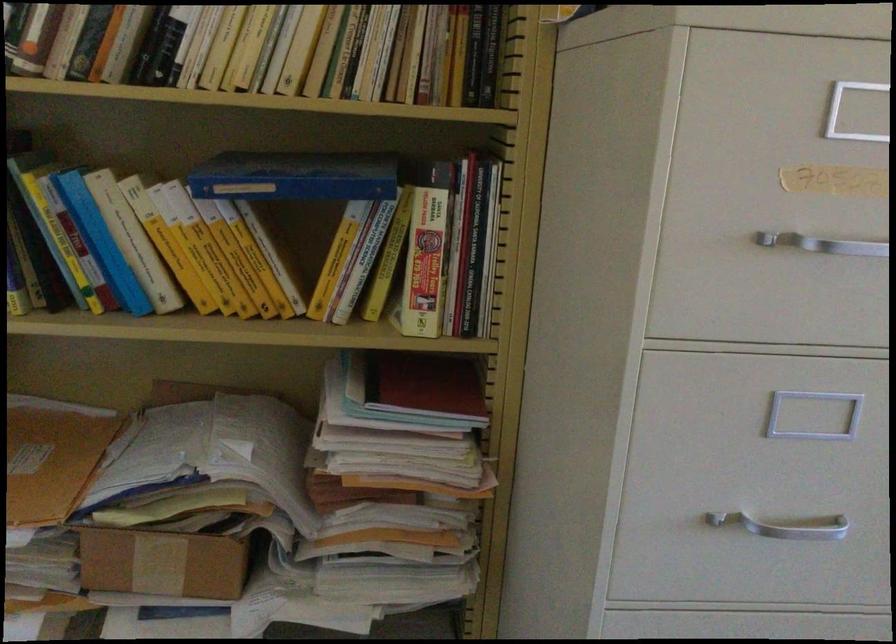
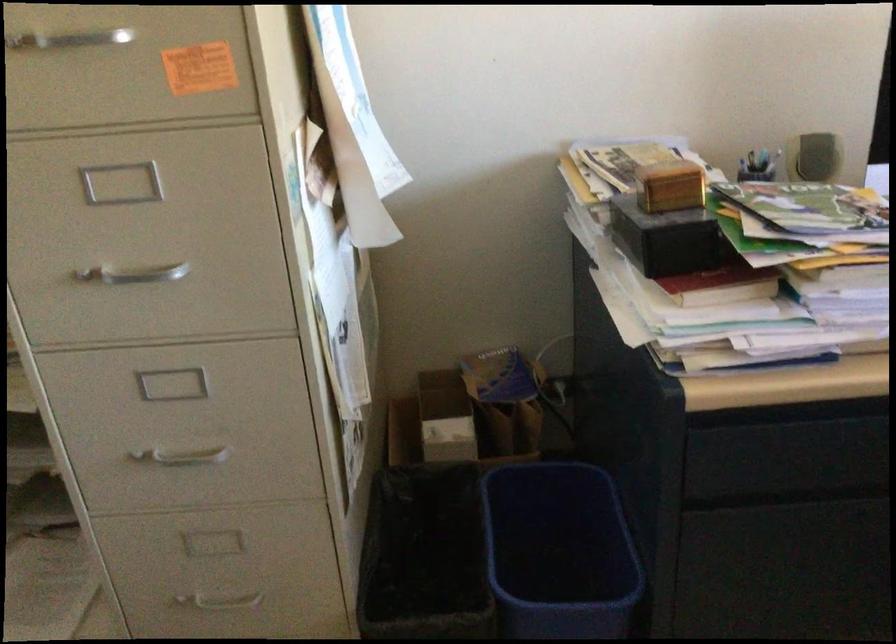
Locate, in the second image, the point that corresponds to (754,524) in the first image.

(134, 274)